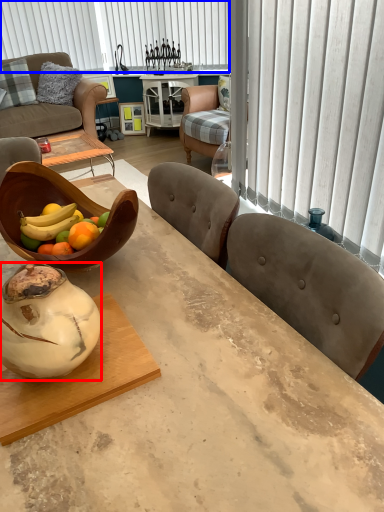
Question: Which object is closer to the camera taking this photo, vase (highlighted by a red box) or blind (highlighted by a blue box)?

Choices:
 (A) vase
 (B) blind

Answer: (A)